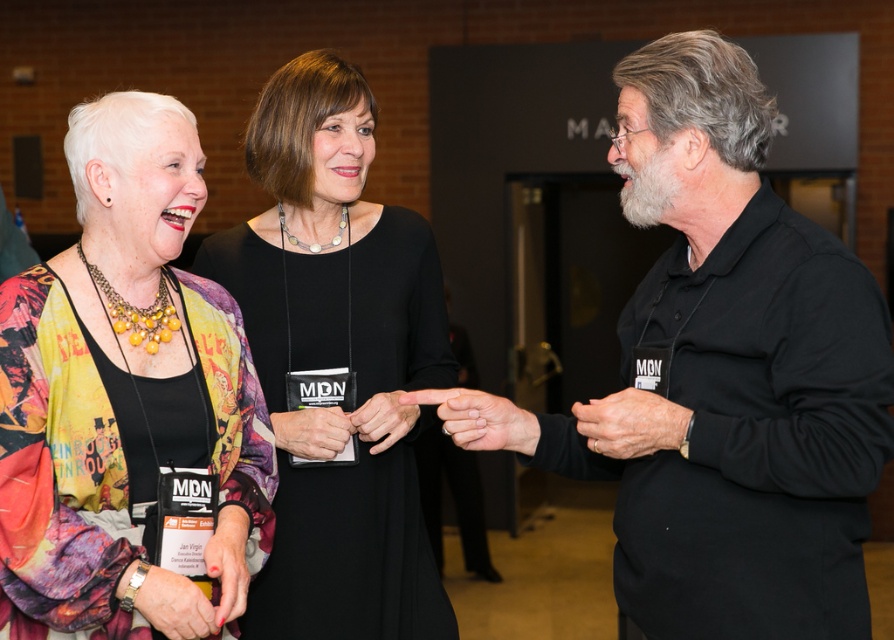
Who is taller, printed silk kimono at left or black fabric dress at center?

Result: black fabric dress at center is taller.

Looking at this image, is printed silk kimono at left above black fabric dress at center?

Actually, printed silk kimono at left is below black fabric dress at center.

Locate an element on the screen. The image size is (894, 640). printed silk kimono at left is located at coordinates (124, 396).

Between black matte shirt at center and black fabric dress at center, which one is positioned lower?

black fabric dress at center is lower down.

Is black matte shirt at center below black fabric dress at center?

Actually, black matte shirt at center is above black fabric dress at center.

Who is more forward, (766, 268) or (342, 596)?

Point (766, 268) is more forward.

Locate an element on the screen. The width and height of the screenshot is (894, 640). black matte shirt at center is located at coordinates (722, 376).

Is point (766, 198) closer to viewer compared to point (100, 100)?

Yes, point (766, 198) is in front of point (100, 100).

Between black matte shirt at center and printed silk kimono at left, which one is positioned higher?

black matte shirt at center

At what (x,y) coordinates should I click in order to perform the action: click on black matte shirt at center. Please return your answer as a coordinate pair (x, y). This screenshot has width=894, height=640. Looking at the image, I should click on (722, 376).

Identify the location of black matte shirt at center. (722, 376).